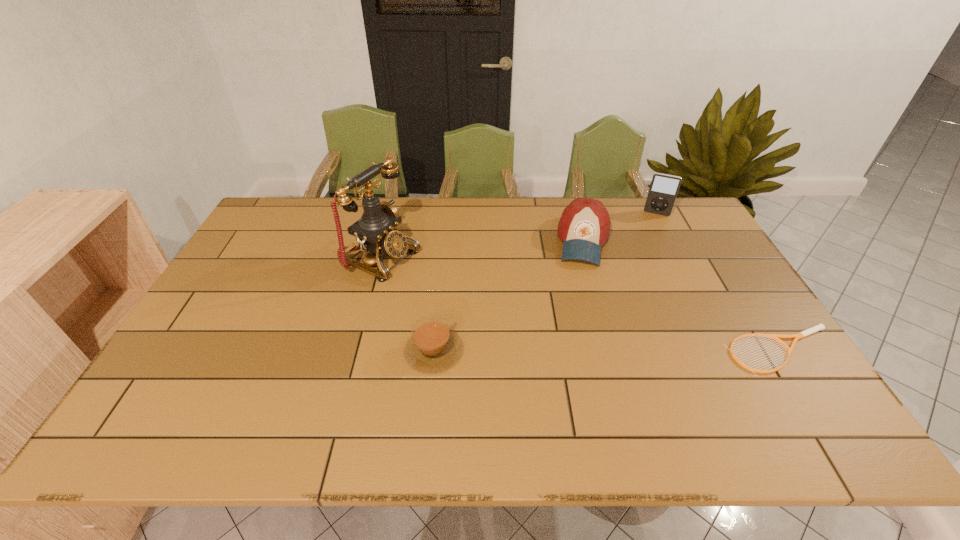
The width and height of the screenshot is (960, 540). I want to click on free space at the far left corner, so click(x=299, y=234).

What are the coordinates of `free space at the near left corner` in the screenshot? It's located at (184, 392).

The width and height of the screenshot is (960, 540). Identify the location of vacant space at the near right corner. (789, 380).

This screenshot has width=960, height=540. In order to click on free space between the baseball cap and the cappuccino in this screenshot , I will do `click(509, 296)`.

In order to click on empty space that is in between the second tallest object and the fourth tallest object in this screenshot , I will do `click(545, 282)`.

Identify the location of unoccupied area between the tallest object and the third object from left to right. The width and height of the screenshot is (960, 540). (483, 249).

Where is `free space between the third tallest object and the tallest object`? The width and height of the screenshot is (960, 540). free space between the third tallest object and the tallest object is located at coordinates (483, 249).

I want to click on unoccupied position between the tallest object and the third object from left to right, so click(x=483, y=249).

This screenshot has height=540, width=960. I want to click on unoccupied area between the tallest object and the shortest object, so click(582, 304).

Identify the location of free space between the third shortest object and the telephone. This screenshot has height=540, width=960. (483, 249).